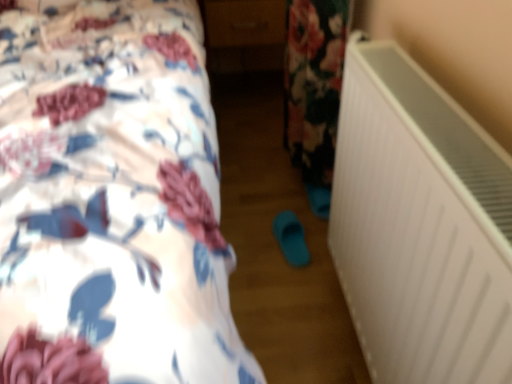
Question: From the image's perspective, relative to floral fabric bed at upper left, is teal rubber slipper at center above or below?

Choices:
 (A) above
 (B) below

Answer: (B)

Question: Is teal rubber slipper at center bigger or smaller than floral fabric bed at upper left?

Choices:
 (A) big
 (B) small

Answer: (B)

Question: Based on their relative distances, which object is nearer to the floral fabric bed at upper left?

Choices:
 (A) white matte radiator at right
 (B) teal rubber slipper at center
 (C) matte brown drawer at center

Answer: (A)

Question: Considering the real-world distances, which object is farthest from the white matte radiator at right?

Choices:
 (A) floral fabric bed at upper left
 (B) teal rubber slipper at center
 (C) matte brown drawer at center

Answer: (C)